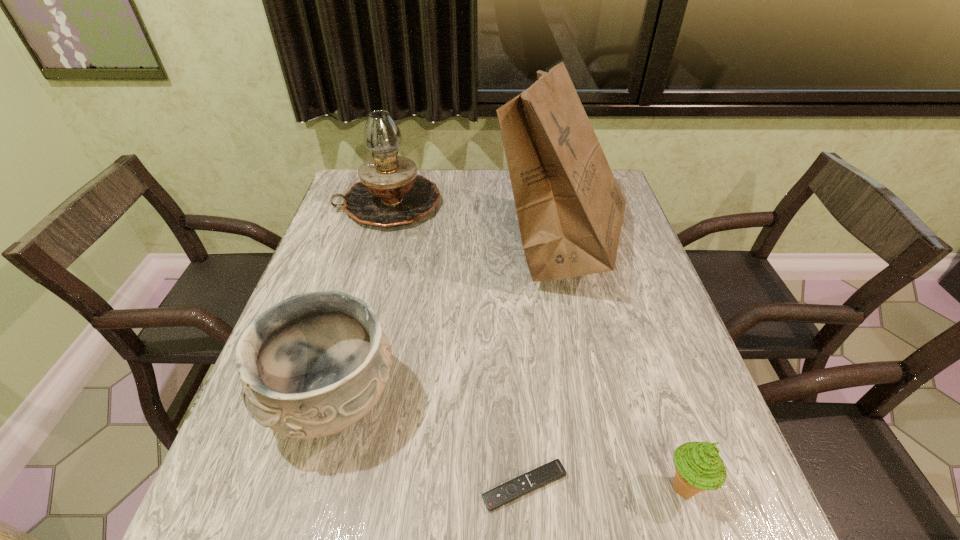
The height and width of the screenshot is (540, 960). I want to click on object positioned at the near right corner, so click(698, 466).

Where is `vacant space at the far edge`? The width and height of the screenshot is (960, 540). vacant space at the far edge is located at coordinates (497, 172).

Find the location of a particular element. This screenshot has height=540, width=960. free spot at the near edge of the desktop is located at coordinates (472, 535).

In the image, there is a desktop. In order to click on vacant space at the left edge in this screenshot , I will do `click(357, 233)`.

The width and height of the screenshot is (960, 540). Find the location of `free space at the right edge`. free space at the right edge is located at coordinates (673, 359).

Image resolution: width=960 pixels, height=540 pixels. What are the coordinates of `vacant area that lies between the icecream and the grocery bag` in the screenshot? It's located at (622, 367).

The height and width of the screenshot is (540, 960). In order to click on free spot between the grocery bag and the oil lamp in this screenshot , I will do point(474,225).

Where is `vacant area between the icecream and the grocery bag`? vacant area between the icecream and the grocery bag is located at coordinates (622, 367).

Find the location of a particular element. This screenshot has height=540, width=960. empty space that is in between the grocery bag and the third shortest object is located at coordinates (446, 324).

Locate an element on the screen. The height and width of the screenshot is (540, 960). free space between the fourth shortest object and the shortest object is located at coordinates (457, 345).